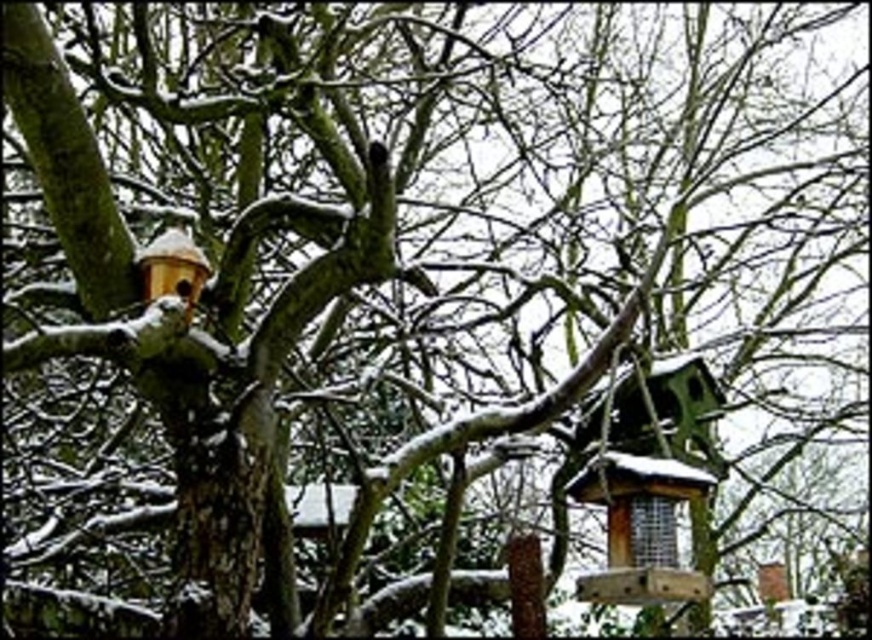
Is green wooden bird feeder at center behind wooden bird feeder at upper left?

Yes, it is.

Who is taller, green wooden bird feeder at center or wooden bird feeder at upper left?

With more height is green wooden bird feeder at center.

Identify the location of green wooden bird feeder at center. (649, 483).